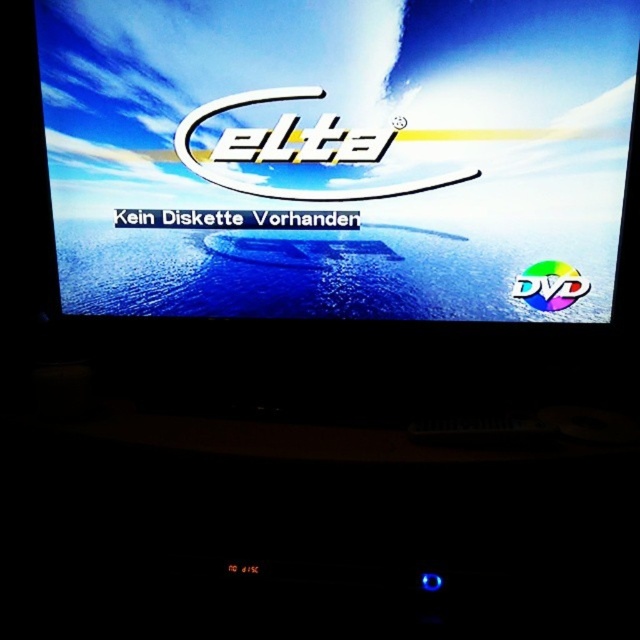
You are setting up a DVD player and notice the screen and DVD. Where is the rainbow plastic dvd at right in relation to the matte plastic screen at center?

The rainbow plastic dvd at right is below the matte plastic screen at center.

What is the relationship between the width of the matte plastic screen at center and the rainbow plastic dvd at right?

The matte plastic screen at center is wider than the rainbow plastic dvd at right.

Based on the photo, you are setting up a DVD player and notice the screen and DVD. Where is the rainbow plastic dvd at right in relation to the matte plastic screen at center?

The rainbow plastic dvd at right is to the right of the matte plastic screen at center.